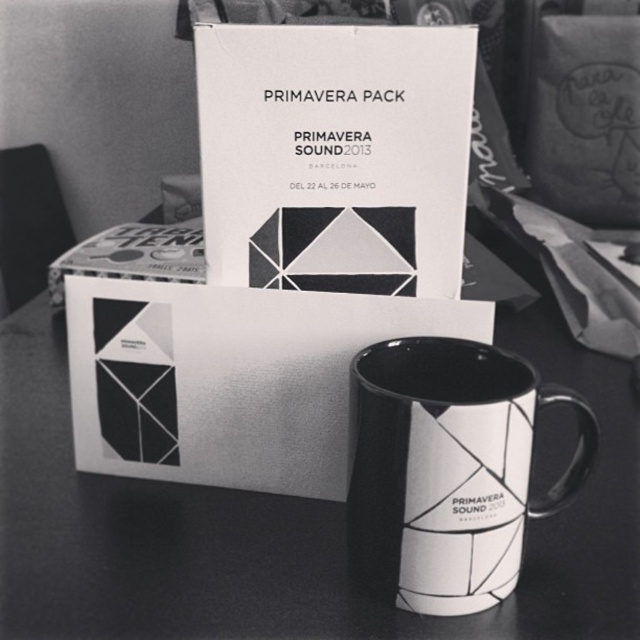
You are setting up a display for the Primavera Sound 2013 promotional items. You need to arrange the white glossy mug at center and the white glossy mug at lower center on a shelf. Which mug should you place on the top shelf to ensure it doesn t fall over, considering their heights?

The white glossy mug at center has a greater height compared to the white glossy mug at lower center. To prevent it from falling over, place the taller white glossy mug at center on the top shelf where there is less risk of tipping due to its stability from being higher up.

Based on the scene description, what object is located at the coordinates point (333, 156)?

The white matte cardboard box at center is located at point (333, 156).

You are setting up a display for the Primavera Sound 2013 merchandise. You need to place the white glossy mug at center and the white matte cardboard box at center on a shelf. If the shelf has limited space, which item should you place first to ensure both fit?

The white glossy mug at center is larger than the white matte cardboard box at center. To ensure both fit on the shelf with limited space, you should place the white glossy mug at center first, then the white matte cardboard box at center next.